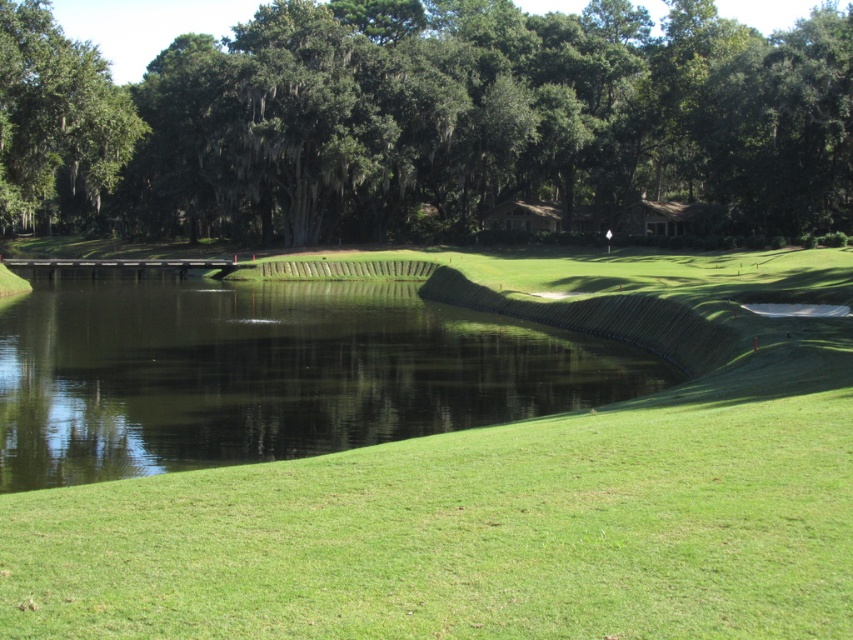
Is green leafy tree at upper center thinner than green leafy tree at upper left?

No, green leafy tree at upper center is not thinner than green leafy tree at upper left.

Who is positioned more to the right, green leafy tree at upper center or green leafy tree at upper left?

Positioned to the right is green leafy tree at upper center.

Which is in front, point (657, 90) or point (41, 35)?

Positioned in front is point (41, 35).

The image size is (853, 640). Identify the location of green leafy tree at upper center. (425, 120).

How distant is green leafy tree at upper center from green grassy bank at lower left?

green leafy tree at upper center is 104.56 feet from green grassy bank at lower left.

Can you confirm if green leafy tree at upper center is positioned to the left of green grassy bank at lower left?

Yes, green leafy tree at upper center is to the left of green grassy bank at lower left.

Image resolution: width=853 pixels, height=640 pixels. I want to click on green leafy tree at upper center, so click(425, 120).

Is green grassy bank at lower left bigger than green leafy tree at upper left?

Incorrect, green grassy bank at lower left is not larger than green leafy tree at upper left.

Does green grassy bank at lower left appear on the right side of green leafy tree at upper left?

Yes, green grassy bank at lower left is to the right of green leafy tree at upper left.

Measure the distance between point [544,348] and camera.

They are 124.29 feet apart.

This screenshot has width=853, height=640. I want to click on green grassy bank at lower left, so click(270, 372).